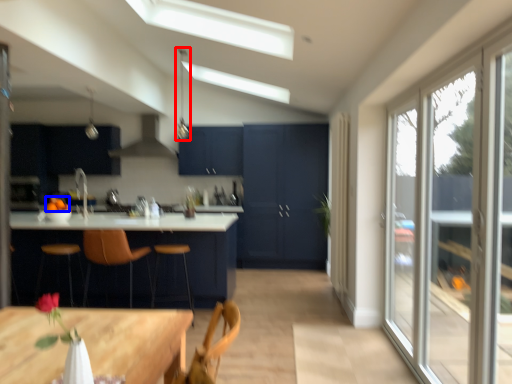
Question: Which object appears farthest to the camera in this image, light fixture (highlighted by a red box) or fruit (highlighted by a blue box)?

Choices:
 (A) light fixture
 (B) fruit

Answer: (A)